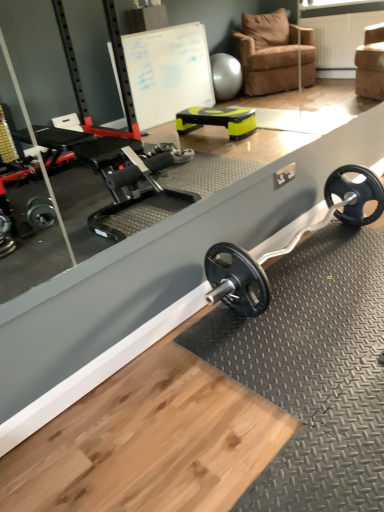
What do you see at coordinates (286, 246) in the screenshot? The image size is (384, 512). I see `polished silver barbell at center` at bounding box center [286, 246].

Locate an element on the screen. polished silver barbell at center is located at coordinates (286, 246).

Measure the distance between polished silver barbell at center and camera.

5.29 feet.

I want to click on polished silver barbell at center, so [286, 246].